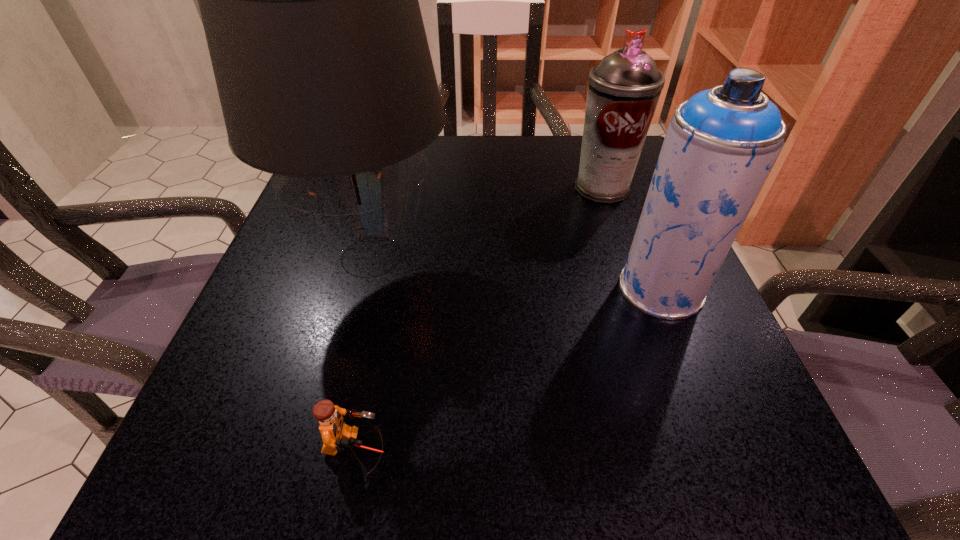
The image size is (960, 540). Identify the location of free space between the farther aerosol can and the lampshade. (x=487, y=222).

The image size is (960, 540). In order to click on free space between the nearest object and the farther aerosol can in this screenshot , I will do `click(479, 319)`.

This screenshot has width=960, height=540. What are the coordinates of `vacant space that's between the nearest object and the tallest object` in the screenshot? It's located at (364, 353).

Identify the location of free space between the tallest object and the farthest object. click(x=487, y=222).

This screenshot has height=540, width=960. Identify the location of vacant region between the Lego and the nearer aerosol can. (509, 369).

You are a GUI agent. You are given a task and a screenshot of the screen. Output one action in this format:
    pyautogui.click(x=<x>, y=<y>)
    Task: Click on the empty space between the nearest object and the nearer aerosol can
    Image resolution: width=960 pixels, height=540 pixels.
    Given the screenshot: What is the action you would take?
    pyautogui.click(x=509, y=369)

Image resolution: width=960 pixels, height=540 pixels. Identify the location of vacant area that lies between the farther aerosol can and the nearest object. (479, 319).

Identify which object is the second nearest to the nearer aerosol can. Please provide its 2D coordinates. Your answer should be formatted as a tuple, i.e. [(x, y)], where the tuple contains the x and y coordinates of a point satisfying the conditions above.

[(309, 1)]

Point out which object is positioned as the nearest to the farthest object. Please provide its 2D coordinates. Your answer should be formatted as a tuple, i.e. [(x, y)], where the tuple contains the x and y coordinates of a point satisfying the conditions above.

[(720, 145)]